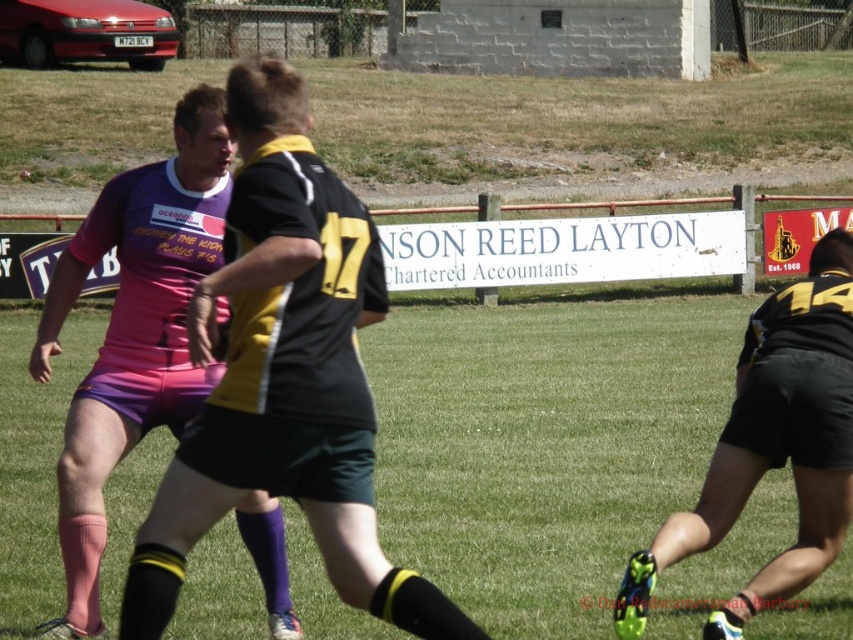
Is pink fabric shorts at center thinner than black matte shorts at right?

Correct, pink fabric shorts at center's width is less than black matte shorts at right's.

Is pink fabric shorts at center shorter than black matte shorts at right?

Correct, pink fabric shorts at center is not as tall as black matte shorts at right.

This screenshot has height=640, width=853. Describe the element at coordinates (134, 330) in the screenshot. I see `pink fabric shorts at center` at that location.

Find the location of a particular element. This screenshot has height=640, width=853. pink fabric shorts at center is located at coordinates (134, 330).

Can you confirm if matte black jersey at center is positioned above black matte shorts at right?

Indeed, matte black jersey at center is positioned over black matte shorts at right.

Does matte black jersey at center appear under black matte shorts at right?

No, matte black jersey at center is not below black matte shorts at right.

What do you see at coordinates (283, 374) in the screenshot? The height and width of the screenshot is (640, 853). I see `matte black jersey at center` at bounding box center [283, 374].

Locate an element on the screen. matte black jersey at center is located at coordinates (283, 374).

Is point (126, 634) more distant than point (202, 120)?

No, it is in front of (202, 120).

The width and height of the screenshot is (853, 640). Describe the element at coordinates (283, 374) in the screenshot. I see `matte black jersey at center` at that location.

This screenshot has width=853, height=640. Identify the location of matte black jersey at center. (283, 374).